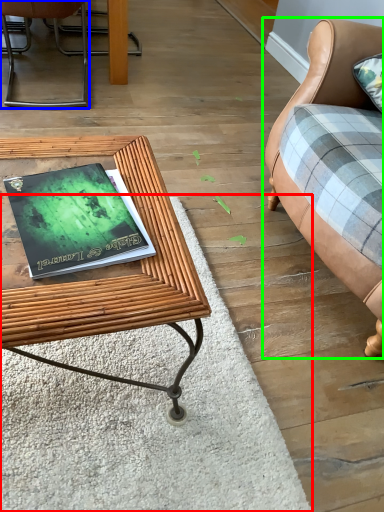
Question: Considering the real-world distances, which object is closest to mat (highlighted by a red box)? chair (highlighted by a blue box) or studio couch (highlighted by a green box).

Choices:
 (A) chair
 (B) studio couch

Answer: (B)